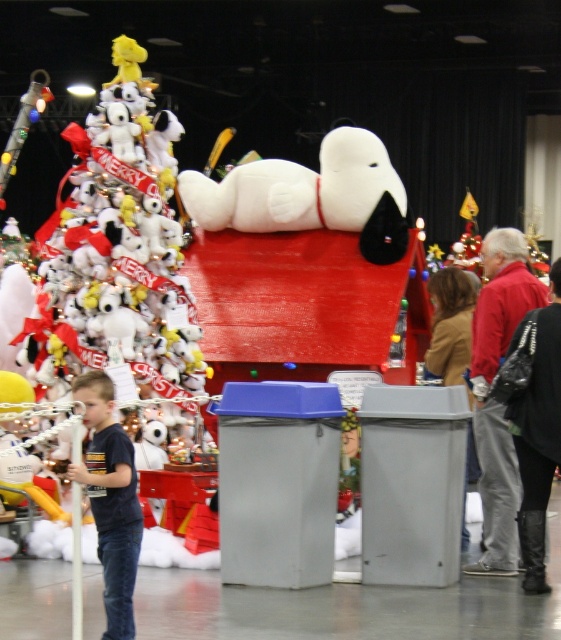
You are standing in front of the festive Snoopy display. There are two points marked in the image. The first point is at coordinate point (66, 317) and the second is at point (479, 452). If you were to walk towards the display, which point would appear closer to you?

Point (66, 317) is further to the viewer than point (479, 452), so the first point would appear closer to you.

You are standing in front of the festive Snoopy display and want to know which of the two points, point (58, 310) or point (438, 333), is closer to you. Can you determine this based on their positions?

Point (58, 310) is further to the viewer than point (438, 333), so the closer point to you is point (438, 333).